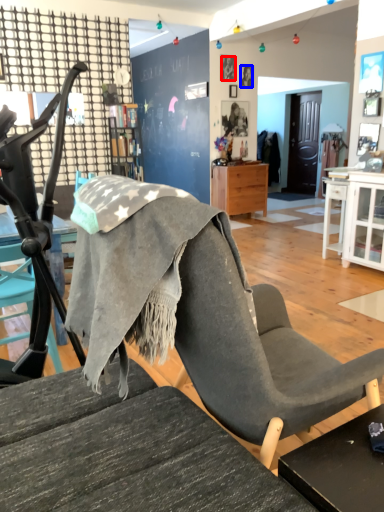
Question: Among these objects, which one is farthest to the camera, person (highlighted by a red box) or person (highlighted by a blue box)?

Choices:
 (A) person
 (B) person

Answer: (B)